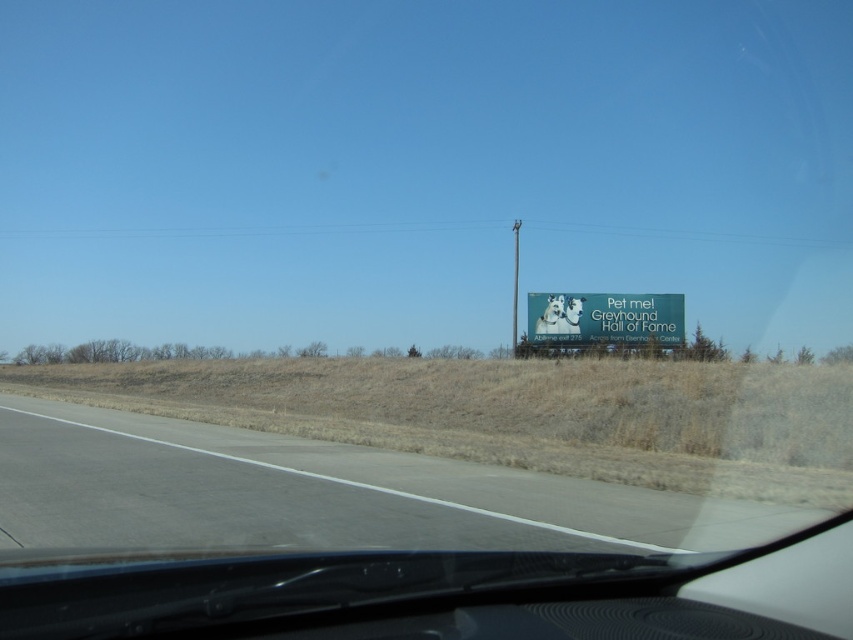
You are a driver approaching the white glossy billboard at right while driving on the gray asphalt road at lower left. Which object is taller?

The white glossy billboard at right is taller than the gray asphalt road at lower left.